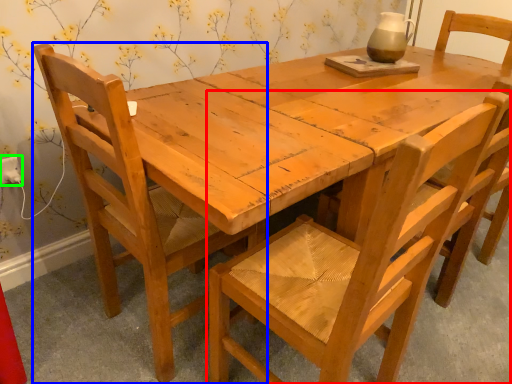
Question: Which is farther away from chair (highlighted by a red box)? chair (highlighted by a blue box) or electric outlet (highlighted by a green box)?

Choices:
 (A) chair
 (B) electric outlet

Answer: (B)